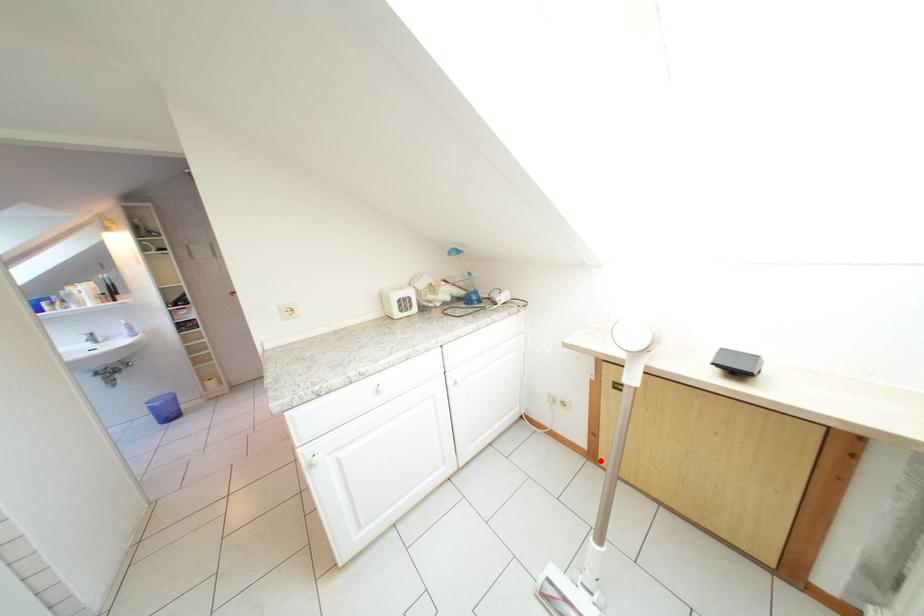
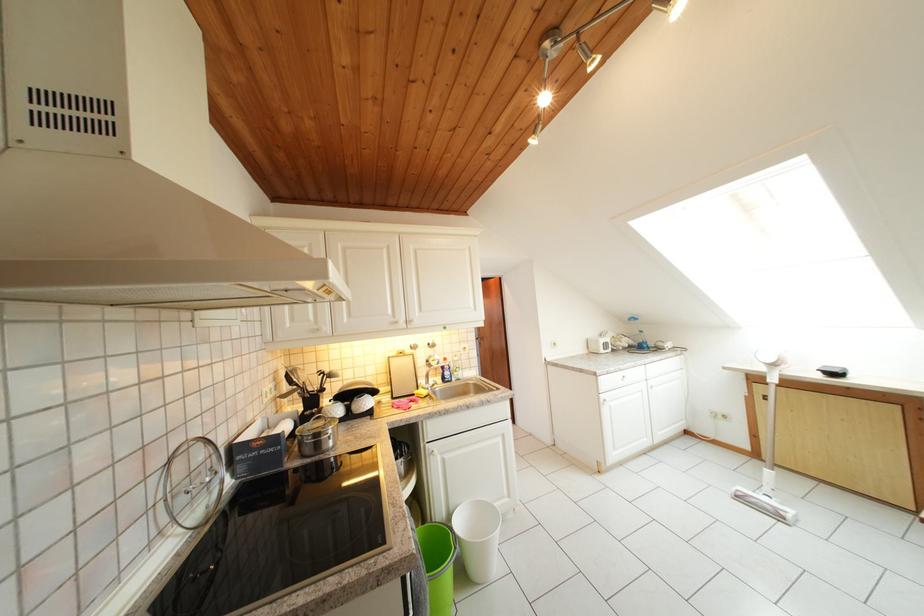
Where in the second image is the point corresponding to the highlighted location from the first image?

(764, 460)